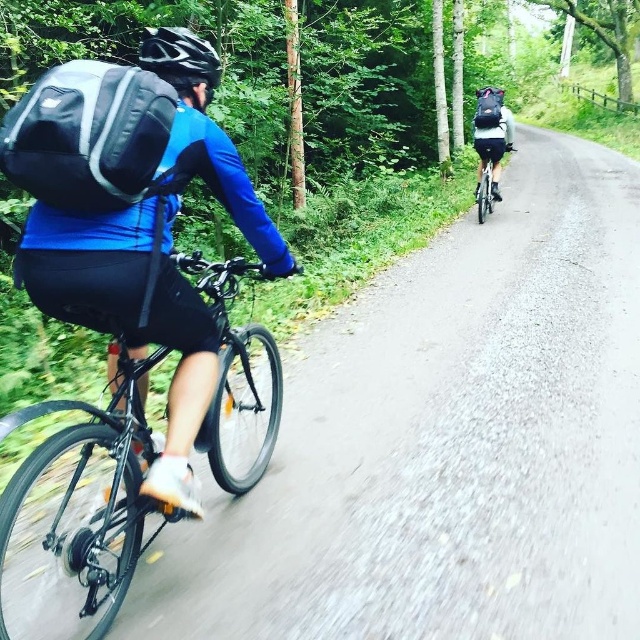
You are a photographer standing at the starting point of the road. You want to take a photo of the shiny black bicycle at left and the matte black backpack at upper right. Which object should you focus on first to ensure both are in the frame?

The shiny black bicycle at left is located below the matte black backpack at upper right, so you should focus on the matte black backpack at upper right first to ensure both are in the frame.

In the scene shown: You are a photographer trying to capture a clear shot of the cyclist with the matte black backpack at left and the black matte helmet at upper left. Since you want to focus on the backpack, which object should you prioritize keeping in the frame and why?

The matte black backpack at left should be prioritized in the frame because it has a greater height compared to the black matte helmet at upper left, making it more prominent.

You are a delivery person who needs to carry a 15 inch laptop in your backpack. You see the matte black backpack at left and the shiny black bicycle at left. Which item has a wider width to accommodate the laptop?

The shiny black bicycle at left has a wider width than the matte black backpack at left, so it is not the backpack that can accommodate the laptop. However, the question seems to conflate bicycle width with backpack capacity. The backpack is narrower, so it may not fit a 15 inch laptop unless it is designed for it. The bicycle width is irrelevant to backpack capacity.